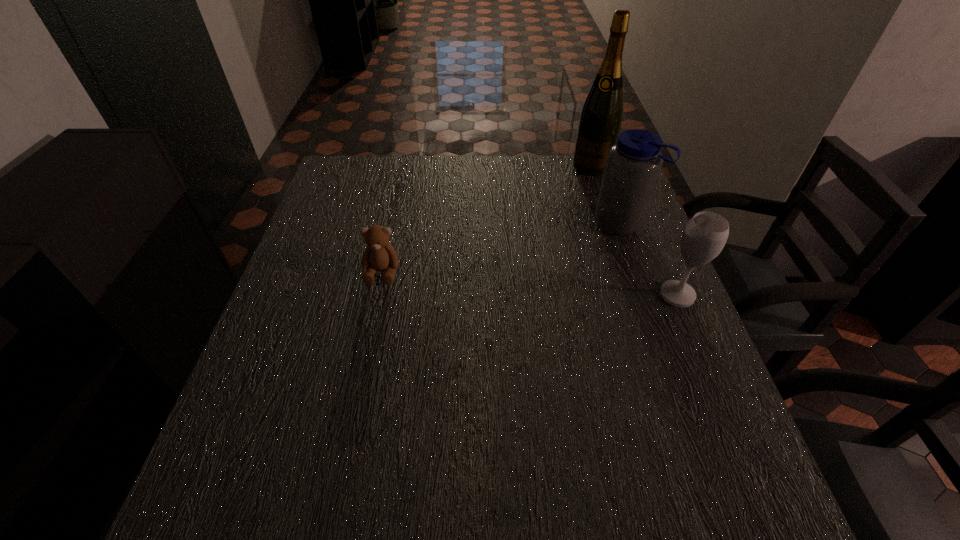
At what (x,y) coordinates should I click in order to perform the action: click on the shortest object. Please return your answer as a coordinate pair (x, y). The height and width of the screenshot is (540, 960). Looking at the image, I should click on (379, 255).

Locate an element on the screen. the leftmost object is located at coordinates (379, 255).

Identify the location of wineglass. Image resolution: width=960 pixels, height=540 pixels. (704, 236).

The image size is (960, 540). Identify the location of the tallest object. (600, 121).

This screenshot has width=960, height=540. I want to click on wine bottle, so click(600, 121).

You are a GUI agent. You are given a task and a screenshot of the screen. Output one action in this format:
    pyautogui.click(x=<x>, y=<y>)
    Task: Click on the water bottle
    The width and height of the screenshot is (960, 540).
    Given the screenshot: What is the action you would take?
    633,164

Image resolution: width=960 pixels, height=540 pixels. I want to click on blank space located on the face of the teddy bear, so click(x=350, y=419).

The width and height of the screenshot is (960, 540). In order to click on vacant point located 0.070m on the back of the second shortest object in this screenshot , I will do `click(663, 261)`.

The height and width of the screenshot is (540, 960). In order to click on free space located on the front-facing side of the farthest object in this screenshot , I will do `click(563, 225)`.

This screenshot has width=960, height=540. Find the location of `free space located on the front-facing side of the farthest object`. free space located on the front-facing side of the farthest object is located at coordinates (583, 184).